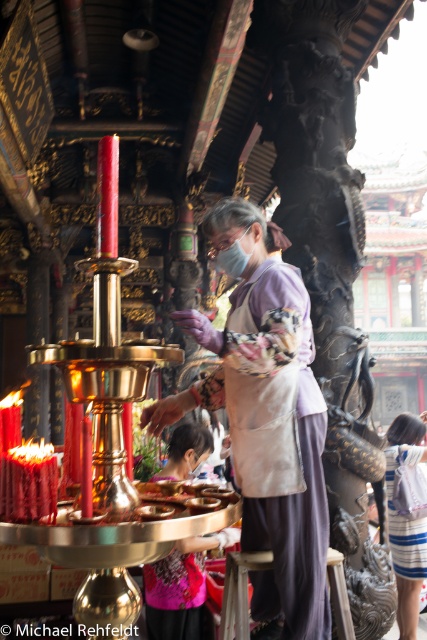
Does purple fabric apron at center have a greater width compared to dark gray fabric stool at center?

Yes, purple fabric apron at center is wider than dark gray fabric stool at center.

Is purple fabric apron at center smaller than dark gray fabric stool at center?

Actually, purple fabric apron at center might be larger than dark gray fabric stool at center.

Does point (213, 397) come farther from viewer compared to point (339, 573)?

Yes, point (213, 397) is farther from viewer.

Where is `purple fabric apron at center`? The width and height of the screenshot is (427, 640). purple fabric apron at center is located at coordinates (266, 420).

Can you confirm if striped fabric dress at lower right is thinner than dark gray fabric stool at center?

No.

Describe the element at coordinates (406, 522) in the screenshot. I see `striped fabric dress at lower right` at that location.

Which is in front, point (406, 620) or point (245, 609)?

Positioned in front is point (245, 609).

Find the location of a particular element. striped fabric dress at lower right is located at coordinates (406, 522).

Is purple fabric apron at center shorter than matte purple blouse at center?

Incorrect, purple fabric apron at center's height does not fall short of matte purple blouse at center's.

Is point (277, 320) more distant than point (178, 467)?

No.

Locate an element on the screen. The image size is (427, 640). purple fabric apron at center is located at coordinates (266, 420).